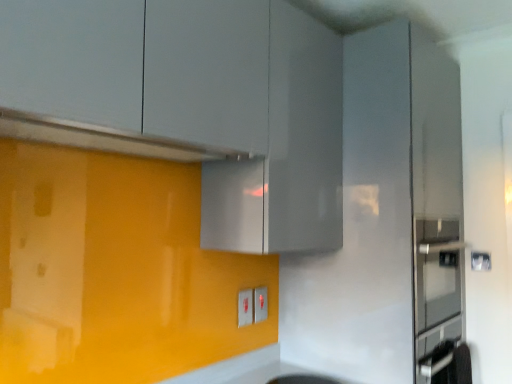
Question: Considering the relative sizes of matte white electric outlet at lower center, which is the 1th electric outlet from back to front, and satin silver exhaust hood at upper center in the image provided, is matte white electric outlet at lower center, which is the 1th electric outlet from back to front, bigger than satin silver exhaust hood at upper center?

Choices:
 (A) no
 (B) yes

Answer: (A)

Question: Considering the relative positions of matte white electric outlet at lower center, arranged as the second electric outlet when viewed from the front, and satin silver exhaust hood at upper center in the image provided, is matte white electric outlet at lower center, arranged as the second electric outlet when viewed from the front, in front of satin silver exhaust hood at upper center?

Choices:
 (A) yes
 (B) no

Answer: (B)

Question: From the image's perspective, is matte white electric outlet at lower center, which appears as the 2th electric outlet when viewed from the left, located above satin silver exhaust hood at upper center?

Choices:
 (A) no
 (B) yes

Answer: (A)

Question: Considering the relative sizes of matte white electric outlet at lower center, which appears as the 2th electric outlet when viewed from the left, and satin silver exhaust hood at upper center in the image provided, is matte white electric outlet at lower center, which appears as the 2th electric outlet when viewed from the left, shorter than satin silver exhaust hood at upper center?

Choices:
 (A) yes
 (B) no

Answer: (B)

Question: From a real-world perspective, is matte white electric outlet at lower center, which appears as the 2th electric outlet when viewed from the left, physically above satin silver exhaust hood at upper center?

Choices:
 (A) yes
 (B) no

Answer: (B)

Question: In the image, is matte gray cabinet at upper center on the left side or the right side of matte white electric outlet at lower center, which is the first electric outlet from right to left?

Choices:
 (A) left
 (B) right

Answer: (A)

Question: Is point (28, 105) positioned closer to the camera than point (263, 302)?

Choices:
 (A) farther
 (B) closer

Answer: (B)

Question: Is matte gray cabinet at upper center inside the boundaries of matte white electric outlet at lower center, which appears as the 2th electric outlet when viewed from the left, or outside?

Choices:
 (A) outside
 (B) inside

Answer: (A)

Question: Considering the positions of matte gray cabinet at upper center and matte white electric outlet at lower center, which appears as the 2th electric outlet when viewed from the left, in the image, is matte gray cabinet at upper center wider or thinner than matte white electric outlet at lower center, which appears as the 2th electric outlet when viewed from the left,?

Choices:
 (A) wide
 (B) thin

Answer: (A)

Question: Is point (15, 38) positioned closer to the camera than point (179, 160)?

Choices:
 (A) closer
 (B) farther

Answer: (A)

Question: Looking at their shapes, would you say matte gray cabinet at upper center is wider or thinner than satin silver exhaust hood at upper center?

Choices:
 (A) wide
 (B) thin

Answer: (A)

Question: From a real-world perspective, is matte gray cabinet at upper center positioned above or below satin silver exhaust hood at upper center?

Choices:
 (A) above
 (B) below

Answer: (A)

Question: Visually, is matte gray cabinet at upper center positioned to the left or to the right of satin silver exhaust hood at upper center?

Choices:
 (A) left
 (B) right

Answer: (B)

Question: From a real-world perspective, is satin silver exhaust hood at upper center physically located above or below matte gray cabinet at upper center?

Choices:
 (A) below
 (B) above

Answer: (A)

Question: In terms of size, does satin silver exhaust hood at upper center appear bigger or smaller than matte gray cabinet at upper center?

Choices:
 (A) small
 (B) big

Answer: (A)